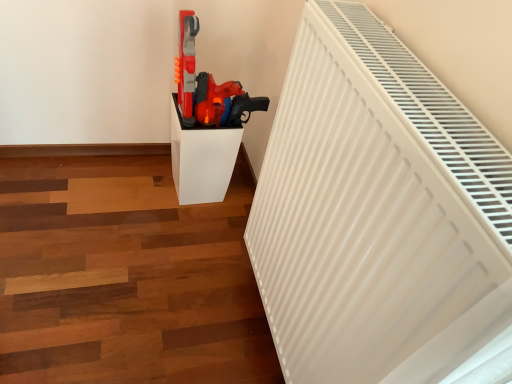
Image resolution: width=512 pixels, height=384 pixels. Describe the element at coordinates (212, 99) in the screenshot. I see `matte plastic toy gun at center` at that location.

Image resolution: width=512 pixels, height=384 pixels. Find the location of `matte plastic toy gun at center`. matte plastic toy gun at center is located at coordinates (212, 99).

This screenshot has width=512, height=384. What do you see at coordinates (378, 214) in the screenshot? I see `white matte radiator at upper right` at bounding box center [378, 214].

Image resolution: width=512 pixels, height=384 pixels. I want to click on matte plastic toy gun at center, so click(x=212, y=99).

From the picture: Between matte plastic toy gun at center and white glossy pedestal at center, which one appears on the left side from the viewer's perspective?

Positioned to the left is white glossy pedestal at center.

Considering the positions of objects matte plastic toy gun at center and white glossy pedestal at center in the image provided, who is behind, matte plastic toy gun at center or white glossy pedestal at center?

matte plastic toy gun at center is behind.

Based on the photo, between matte plastic toy gun at center and white glossy pedestal at center, which one has more height?

With more height is white glossy pedestal at center.

Which of these two, white glossy pedestal at center or matte plastic toy gun at center, stands shorter?

Standing shorter between the two is matte plastic toy gun at center.

Can matte plastic toy gun at center be found inside white glossy pedestal at center?

Definitely not — matte plastic toy gun at center is not inside white glossy pedestal at center.

How many degrees apart are the facing directions of white glossy pedestal at center and matte plastic toy gun at center?

0.000911 degrees separate the facing orientations of white glossy pedestal at center and matte plastic toy gun at center.

Considering the points (376, 95) and (264, 109), which point is in front, point (376, 95) or point (264, 109)?

Positioned in front is point (376, 95).

How far apart are white matte radiator at upper right and matte plastic toy gun at center?

79.57 centimeters.

Considering the relative sizes of white matte radiator at upper right and matte plastic toy gun at center in the image provided, is white matte radiator at upper right smaller than matte plastic toy gun at center?

Incorrect, white matte radiator at upper right is not smaller in size than matte plastic toy gun at center.

From the picture: Who is more distant, white matte radiator at upper right or matte plastic toy gun at center?

matte plastic toy gun at center is further away from the camera.

Is the position of white glossy pedestal at center less distant than that of matte plastic toy gun at center?

Yes, white glossy pedestal at center is in front of matte plastic toy gun at center.

Does white glossy pedestal at center have a greater width compared to matte plastic toy gun at center?

Correct, the width of white glossy pedestal at center exceeds that of matte plastic toy gun at center.

Between point (201, 172) and point (248, 104), which one is positioned in front?

The point (248, 104) is closer.

Is white glossy pedestal at center oriented away from matte plastic toy gun at center?

No.

From the image's perspective, which one is positioned higher, white glossy pedestal at center or white matte radiator at upper right?

white glossy pedestal at center, from the image's perspective.

From a real-world perspective, between white glossy pedestal at center and white matte radiator at upper right, who is vertically lower?

white glossy pedestal at center.

Does white glossy pedestal at center turn towards white matte radiator at upper right?

Yes, white glossy pedestal at center faces towards white matte radiator at upper right.

Are white matte radiator at upper right and white glossy pedestal at center making contact?

white matte radiator at upper right is not next to white glossy pedestal at center, and they're not touching.

Is point (376, 49) in front of point (218, 130)?

Yes, it is.

Can you confirm if white matte radiator at upper right is positioned to the right of white glossy pedestal at center?

Yes.

Identify the location of furniture below the white matte radiator at upper right (from a real-world perspective). The image size is (512, 384). (202, 159).

Where is `weapon below the matte plastic toy gun at center (from a real-world perspective)`? weapon below the matte plastic toy gun at center (from a real-world perspective) is located at coordinates (245, 108).

Considering the sizes of objects matte plastic toy gun at center and matte plastic toy gun at center in the image provided, who is smaller, matte plastic toy gun at center or matte plastic toy gun at center?

Smaller between the two is matte plastic toy gun at center.

What's the angular difference between matte plastic toy gun at center and matte plastic toy gun at center's facing directions?

The facing directions of matte plastic toy gun at center and matte plastic toy gun at center are 0.000766 degrees apart.

From a real-world perspective, is matte plastic toy gun at center on matte plastic toy gun at center?

No, from a real-world perspective, matte plastic toy gun at center is not on top of matte plastic toy gun at center.

Identify the location of weapon above the white glossy pedestal at center (from the image's perspective). The width and height of the screenshot is (512, 384). (245, 108).

Where is `furniture on the left of matte plastic toy gun at center`? The image size is (512, 384). furniture on the left of matte plastic toy gun at center is located at coordinates (202, 159).

Consider the image. Which object lies nearer to the anchor point matte plastic toy gun at center, matte plastic toy gun at center or white matte radiator at upper right?

Among the two, matte plastic toy gun at center is located nearer to matte plastic toy gun at center.

Estimate the real-world distances between objects in this image. Which object is closer to white glossy pedestal at center, matte plastic toy gun at center or matte plastic toy gun at center?

Among the two, matte plastic toy gun at center is located nearer to white glossy pedestal at center.

Based on their spatial positions, is white matte radiator at upper right or matte plastic toy gun at center closer to matte plastic toy gun at center?

Based on the image, matte plastic toy gun at center appears to be nearer to matte plastic toy gun at center.

Which object lies further to the anchor point matte plastic toy gun at center, matte plastic toy gun at center or white matte radiator at upper right?

The object further to matte plastic toy gun at center is white matte radiator at upper right.

From the picture: Which object lies nearer to the anchor point matte plastic toy gun at center, white matte radiator at upper right or matte plastic toy gun at center?

matte plastic toy gun at center is closer to matte plastic toy gun at center.

When comparing their distances from matte plastic toy gun at center, does matte plastic toy gun at center or white glossy pedestal at center seem further?

white glossy pedestal at center.

Based on their spatial positions, is matte plastic toy gun at center or white matte radiator at upper right further from white glossy pedestal at center?

white matte radiator at upper right is positioned further to the anchor white glossy pedestal at center.

In the scene shown: Estimate the real-world distances between objects in this image. Which object is further from matte plastic toy gun at center, matte plastic toy gun at center or matte plastic toy gun at center?

matte plastic toy gun at center lies further to matte plastic toy gun at center than the other object.

Identify the location of equipment between white matte radiator at upper right and matte plastic toy gun at center from front to back. (186, 66).

The height and width of the screenshot is (384, 512). What are the coordinates of `equipment positioned between white matte radiator at upper right and white glossy pedestal at center from near to far` in the screenshot? It's located at (186, 66).

This screenshot has height=384, width=512. What are the coordinates of `toy between white matte radiator at upper right and white glossy pedestal at center in the front-back direction` in the screenshot? It's located at (212, 99).

Locate an element on the screen. toy between white matte radiator at upper right and matte plastic toy gun at center from front to back is located at coordinates (212, 99).